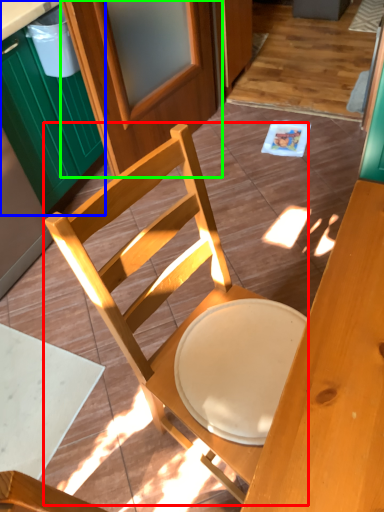
Question: Which object is the closest to the chair (highlighted by a red box)? Choose among these: cabinetry (highlighted by a blue box) or screen door (highlighted by a green box).

Choices:
 (A) cabinetry
 (B) screen door

Answer: (A)